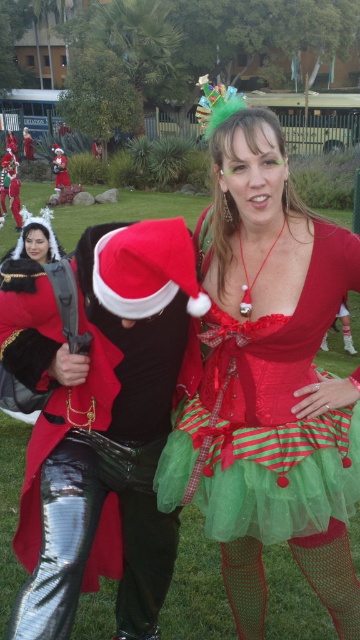
You are a photographer setting up for a photoshoot and need to ensure that both the shiny red dress at center and the shiny black pants at center are visible in the frame. Based on their positions, which clothing item is covering part of the other?

The shiny red dress at center is positioned over the shiny black pants at center, so it is covering part of the shiny black pants at center.

You are a photographer setting up for a holiday photoshoot. You need to position the two main subjects so that the shiny black pants at center are on the left side of the frame and the shiny red dress at center is on the right side. Based on the current arrangement, is this already the case or does it need adjustment?

The shiny red dress at center is already to the right of the shiny black pants at center, so the current arrangement meets the requirement without needing adjustment.

You are standing in the festive outdoor scene and want to find the shiny red dress at center. Which direction should you look to locate the point at coordinates point (267, 378)?

The point at coordinates point (267, 378) is located on the shiny red dress at center, so you should look towards the center of the scene to find it.